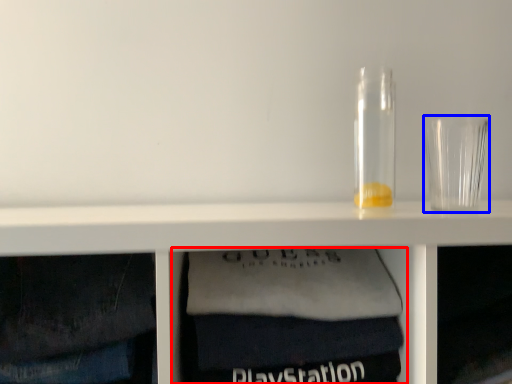
Question: Which point is closer to the camera, cabinet (highlighted by a red box) or shot glass (highlighted by a blue box)?

Choices:
 (A) cabinet
 (B) shot glass

Answer: (A)